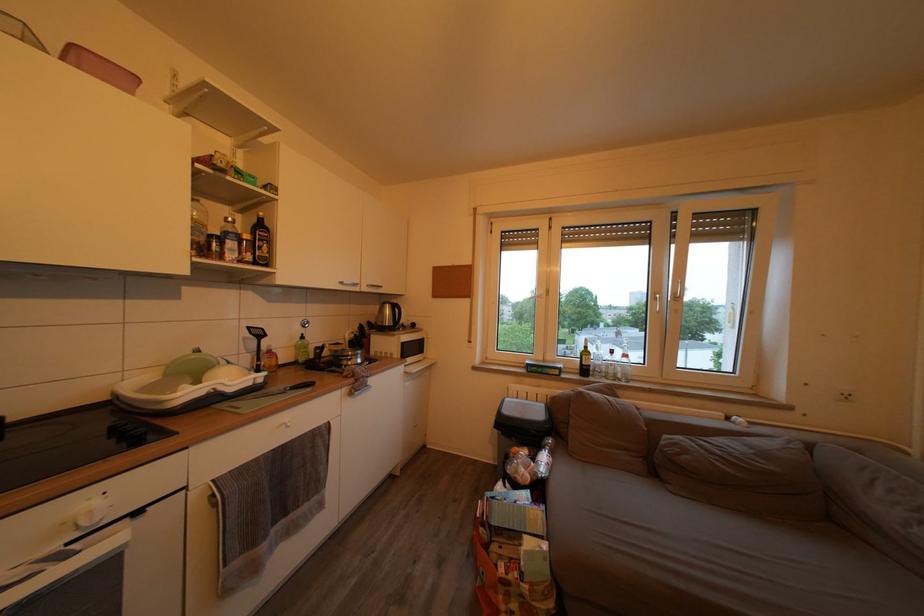
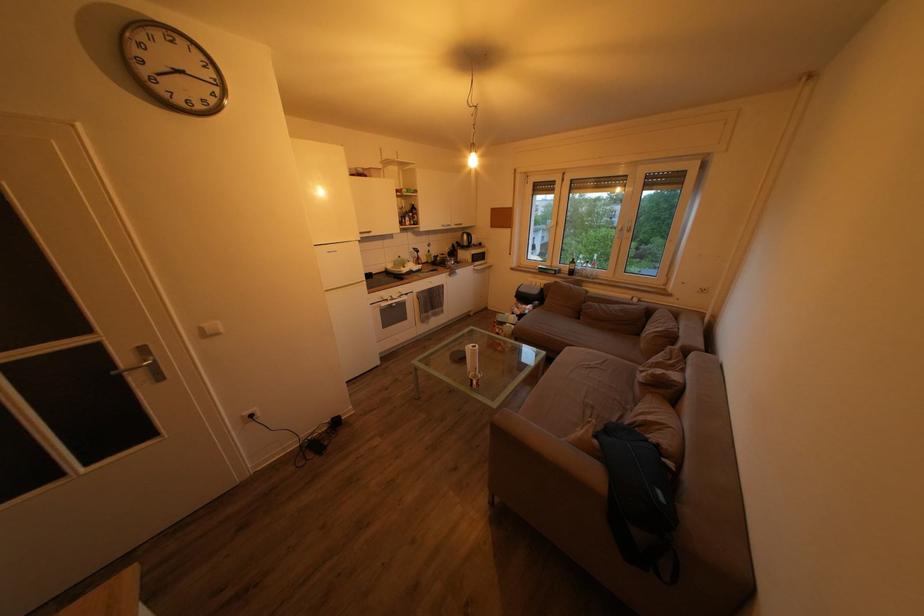
The images are taken continuously from a first-person perspective. In which direction are you moving?

The cameraman walked toward right, backward.